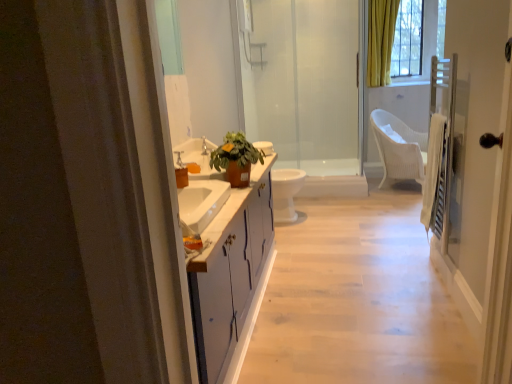
Describe the element at coordinates (285, 193) in the screenshot. This screenshot has width=512, height=384. I see `white glossy toilet at center` at that location.

The height and width of the screenshot is (384, 512). What do you see at coordinates (474, 140) in the screenshot? I see `transparent glass screen door at right` at bounding box center [474, 140].

The height and width of the screenshot is (384, 512). I want to click on white glossy cabinet at center, so click(x=358, y=299).

In the image, there is a matte brown pot at center. In order to click on plain below it (from the image's perspective) in this screenshot , I will do `click(358, 299)`.

Based on the photo, from a real-world perspective, is matte brown pot at center beneath white glossy cabinet at center?

No, from a real-world perspective, matte brown pot at center is not under white glossy cabinet at center.

Considering the positions of point (245, 158) and point (388, 208), is point (245, 158) closer or farther from the camera than point (388, 208)?

Point (245, 158) is closer to the camera than point (388, 208).

From the image's perspective, is matte brown pot at center beneath white glossy cabinet at center?

Incorrect, from the image's perspective, matte brown pot at center is higher than white glossy cabinet at center.

From the image's perspective, which is below, transparent glass shower door at center or white glossy toilet at center?

white glossy toilet at center, from the image's perspective.

Is transparent glass shower door at center surrounding white glossy toilet at center?

No, white glossy toilet at center is not inside transparent glass shower door at center.

Is transparent glass shower door at center far from white glossy toilet at center?

Yes.

Between transparent glass shower door at center and white glossy toilet at center, which one appears on the left side from the viewer's perspective?

white glossy toilet at center is more to the left.

Is point (228, 151) more distant than point (246, 155)?

Yes, it is.

Is matte brown pot at center positioned with its back to matte brown pot at center?

Yes, matte brown pot at center is at the back of matte brown pot at center.

From the image's perspective, is matte brown pot at center above matte brown pot at center?

Indeed, from the image's perspective, matte brown pot at center is shown above matte brown pot at center.

Is white glossy toilet at center at the back of white wicker chair at center?

No, white wicker chair at center's orientation is not away from white glossy toilet at center.

Are white wicker chair at center and white glossy toilet at center far apart?

Indeed, white wicker chair at center is not near white glossy toilet at center.

Does point (423, 180) lie behind point (280, 186)?

Yes, it is.

Can you confirm if white wicker chair at center is shorter than white glossy toilet at center?

Incorrect, the height of white wicker chair at center does not fall short of that of white glossy toilet at center.

From the image's perspective, would you say matte brown pot at center is shown under yellow curtain at upper right?

Yes, from the image's perspective, matte brown pot at center is beneath yellow curtain at upper right.

Can you tell me how much matte brown pot at center and yellow curtain at upper right differ in facing direction?

The angular difference between matte brown pot at center and yellow curtain at upper right is 90.1 degrees.

You are a GUI agent. You are given a task and a screenshot of the screen. Output one action in this format:
    pyautogui.click(x=<x>, y=<y>)
    Task: Click on the window on the right of matte brown pot at center
    The height and width of the screenshot is (384, 512).
    Given the screenshot: What is the action you would take?
    (417, 37)

Which of these two, matte brown pot at center or yellow curtain at upper right, is wider?

matte brown pot at center.

From a real-world perspective, between transparent glass shower door at center and matte brown pot at center, who is vertically lower?

matte brown pot at center.

Is transparent glass shower door at center positioned with its back to matte brown pot at center?

No, transparent glass shower door at center is not facing the opposite direction of matte brown pot at center.

Can matte brown pot at center be found inside transparent glass shower door at center?

No.

Which object is more forward, transparent glass shower door at center or matte brown pot at center?

matte brown pot at center is more forward.

Which object is closer to the camera taking this photo, white glossy cabinet at center or yellow curtain at upper right?

white glossy cabinet at center is in front.

Looking at this image, can you confirm if white glossy cabinet at center is thinner than yellow curtain at upper right?

No, white glossy cabinet at center is not thinner than yellow curtain at upper right.

Is yellow curtain at upper right inside white glossy cabinet at center?

No, yellow curtain at upper right is not inside white glossy cabinet at center.

How different are the orientations of white glossy cabinet at center and yellow curtain at upper right in degrees?

They differ by 180 degrees in their facing directions.

Identify the location of plain on the right of matte brown pot at center. This screenshot has width=512, height=384. (358, 299).

At what (x,y) coordinates should I click in order to perform the action: click on shower door above the white glossy toilet at center (from the image's perspective). Please return your answer as a coordinate pair (x, y). Looking at the image, I should click on (306, 88).

Estimate the real-world distances between objects in this image. Which object is closer to white glossy toilet at center, matte brown pot at center or matte brown pot at center?

Among the two, matte brown pot at center is located nearer to white glossy toilet at center.

From the image, which object appears to be nearer to white glossy cabinet at center, yellow curtain at upper right or transparent glass screen door at right?

transparent glass screen door at right is closer to white glossy cabinet at center.

Looking at the image, which one is located further to transparent glass screen door at right, matte brown pot at center or transparent glass shower door at center?

Among the two, transparent glass shower door at center is located further to transparent glass screen door at right.

Considering their positions, is white glossy cabinet at center positioned further to transparent glass shower door at center than matte brown pot at center?

matte brown pot at center lies further to transparent glass shower door at center than the other object.

When comparing their distances from yellow curtain at upper right, does matte brown pot at center or matte brown pot at center seem further?

Based on the image, matte brown pot at center appears to be further to yellow curtain at upper right.

Estimate the real-world distances between objects in this image. Which object is further from white glossy cabinet at center, white wicker chair at center or yellow curtain at upper right?

Based on the image, yellow curtain at upper right appears to be further to white glossy cabinet at center.

Which object lies further to the anchor point yellow curtain at upper right, white glossy toilet at center or matte brown pot at center?

Among the two, matte brown pot at center is located further to yellow curtain at upper right.

Based on their spatial positions, is white glossy toilet at center or matte brown pot at center closer to white glossy cabinet at center?

white glossy toilet at center.

Find the location of a particular element. The image size is (512, 384). chair between yellow curtain at upper right and white glossy toilet at center from top to bottom is located at coordinates (399, 148).

Find the location of `shower door between transparent glass screen door at right and yellow curtain at upper right from front to back`. shower door between transparent glass screen door at right and yellow curtain at upper right from front to back is located at coordinates pyautogui.click(x=306, y=88).

Identify the location of flower located between matte brown pot at center and white wicker chair at center in the depth direction. The width and height of the screenshot is (512, 384). (227, 147).

Find the location of a particular element. The width and height of the screenshot is (512, 384). plain between transparent glass screen door at right and matte brown pot at center in the front-back direction is located at coordinates (358, 299).